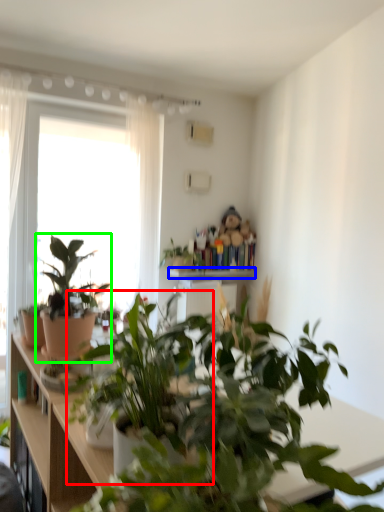
Question: Which object is the farthest from houseplant (highlighted by a red box)? Choose among these: window sill (highlighted by a blue box) or houseplant (highlighted by a green box).

Choices:
 (A) window sill
 (B) houseplant

Answer: (A)